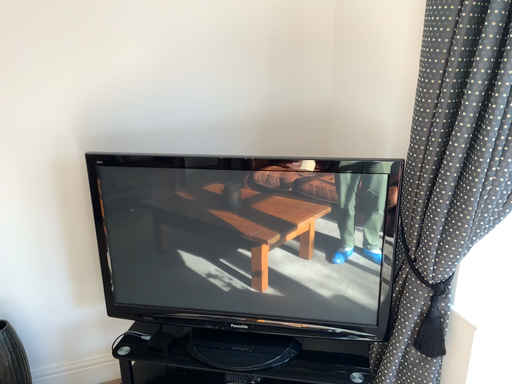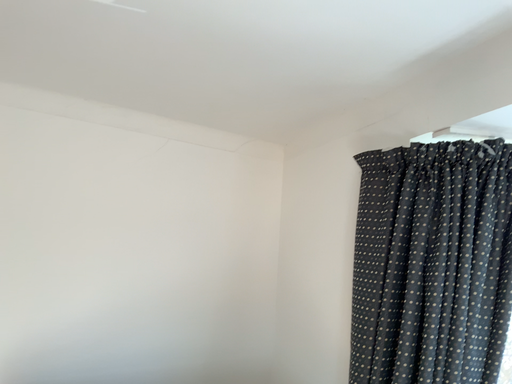
Question: How did the camera likely rotate when shooting the video?

Choices:
 (A) rotated right
 (B) rotated left

Answer: (A)